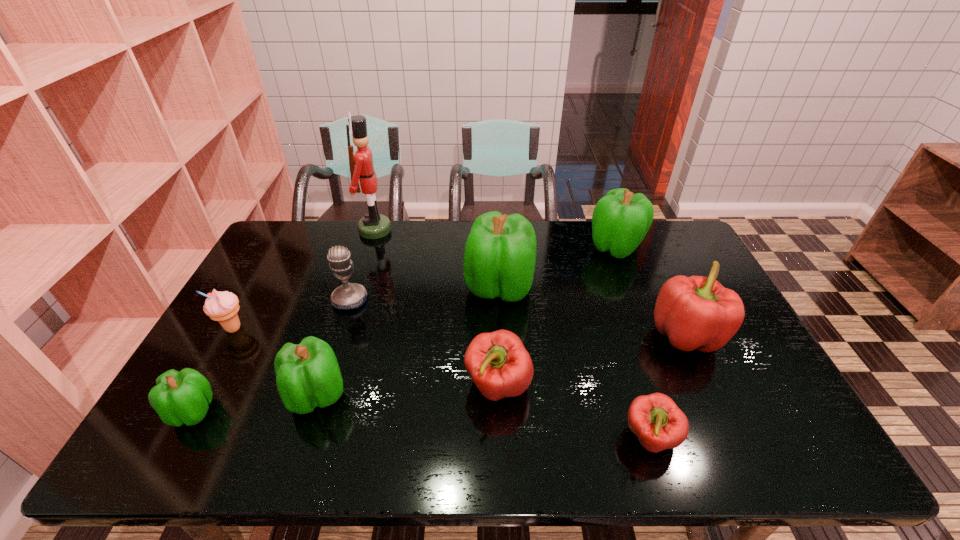
Where is `nutcracker`? nutcracker is located at coordinates (373, 225).

At what (x,y) coordinates should I click in order to perform the action: click on the tallest object. Please return your answer as a coordinate pair (x, y). Image resolution: width=960 pixels, height=540 pixels. Looking at the image, I should click on (373, 225).

Find the location of `the third green bell pepper from left to right`. the third green bell pepper from left to right is located at coordinates (500, 253).

Find the location of a particular element. This screenshot has height=540, width=960. the third nearest green bell pepper is located at coordinates (500, 253).

Identify the location of the farthest bell pepper. The height and width of the screenshot is (540, 960). (621, 219).

Locate an element on the screen. The height and width of the screenshot is (540, 960). the rightmost green bell pepper is located at coordinates (621, 219).

Locate an element on the screen. The width and height of the screenshot is (960, 540). microphone is located at coordinates (349, 295).

Locate an element on the screen. Image resolution: width=960 pixels, height=540 pixels. the rightmost pink bell pepper is located at coordinates (696, 312).

I want to click on the third biggest green bell pepper, so click(x=307, y=375).

The image size is (960, 540). What are the coordinates of `the sixth bell pepper from right to left` in the screenshot? It's located at (307, 375).